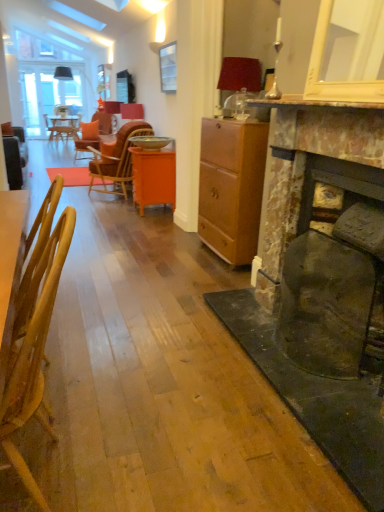
This screenshot has height=512, width=384. What do you see at coordinates (112, 113) in the screenshot? I see `matte orange lampshade at upper center, arranged as the second lamp when ordered from the bottom` at bounding box center [112, 113].

The width and height of the screenshot is (384, 512). What do you see at coordinates (240, 74) in the screenshot?
I see `matte red lampshade at upper right, which is counted as the first lamp, starting from the right` at bounding box center [240, 74].

Where is `matte red lampshade at upper right, the first lamp positioned from the front`? This screenshot has width=384, height=512. matte red lampshade at upper right, the first lamp positioned from the front is located at coordinates (240, 74).

In order to click on rusty stone fireplace at right in this screenshot , I will do `click(329, 280)`.

Identify the location of matte orange lampshade at upper center, the second lamp from the right. (112, 113).

From the picture: Between clear glass picture frame at upper center and metallic gold bowl at center, which one has more height?

clear glass picture frame at upper center is taller.

Is clear glass picture frame at upper center far away from metallic gold bowl at center?

No, clear glass picture frame at upper center is in close proximity to metallic gold bowl at center.

I want to click on round table behind the clear glass picture frame at upper center, so click(150, 142).

Is matte orange lampshade at upper center, which ranks as the 1th lamp in left-to-right order, closer to the viewer compared to clear glass picture frame at upper center?

That is False.

From a real-world perspective, does matte orange lampshade at upper center, which ranks as the second lamp in front-to-back order, stand above clear glass picture frame at upper center?

Actually, matte orange lampshade at upper center, which ranks as the second lamp in front-to-back order, is physically below clear glass picture frame at upper center in the real world.

From the image's perspective, is matte orange lampshade at upper center, which ranks as the 1th lamp in left-to-right order, located above clear glass picture frame at upper center?

Indeed, from the image's perspective, matte orange lampshade at upper center, which ranks as the 1th lamp in left-to-right order, is shown above clear glass picture frame at upper center.

Between matte orange lampshade at upper center, arranged as the second lamp when ordered from the bottom, and clear glass picture frame at upper center, which one has smaller width?

With smaller width is clear glass picture frame at upper center.

Is the surface of orange glossy cabinet at center in direct contact with matte orange lampshade at upper center, which ranks as the 1th lamp in left-to-right order?

orange glossy cabinet at center is not next to matte orange lampshade at upper center, which ranks as the 1th lamp in left-to-right order, and they're not touching.

Is orange glossy cabinet at center further to the viewer compared to matte orange lampshade at upper center, which ranks as the 1th lamp in back-to-front order?

No, the depth of orange glossy cabinet at center is less than that of matte orange lampshade at upper center, which ranks as the 1th lamp in back-to-front order.

From a real-world perspective, which object rests below the other?

From a 3D spatial view, orange glossy cabinet at center is below.

Considering the positions of objects orange glossy cabinet at center and matte orange lampshade at upper center, which is the first lamp from top to bottom, in the image provided, who is more to the left, orange glossy cabinet at center or matte orange lampshade at upper center, which is the first lamp from top to bottom,?

Positioned to the left is matte orange lampshade at upper center, which is the first lamp from top to bottom.

You are a GUI agent. You are given a task and a screenshot of the screen. Output one action in this format:
    pyautogui.click(x=<x>, y=<y>)
    Task: Click on the picture frame behind the wooden chair at left, which is the first chair in bottom-to-top order
    
    Given the screenshot: What is the action you would take?
    pyautogui.click(x=168, y=68)

Is wooden chair at left, the second chair from the top, in front of or behind clear glass picture frame at upper center in the image?

Visually, wooden chair at left, the second chair from the top, is located in front of clear glass picture frame at upper center.

Considering the sizes of wooden chair at left, the second chair from the top, and clear glass picture frame at upper center in the image, is wooden chair at left, the second chair from the top, bigger or smaller than clear glass picture frame at upper center?

Clearly, wooden chair at left, the second chair from the top, is larger in size than clear glass picture frame at upper center.

How far apart are wooden chair at left, which is the first chair in bottom-to-top order, and matte brown cabinet at center?

They are 6.51 feet apart.

Is wooden chair at left, which is the first chair in bottom-to-top order, taller than matte brown cabinet at center?

In fact, wooden chair at left, which is the first chair in bottom-to-top order, may be shorter than matte brown cabinet at center.

In the scene shown: Can you tell me how much wooden chair at left, which is the first chair in bottom-to-top order, and matte brown cabinet at center differ in facing direction?

The angular difference between wooden chair at left, which is the first chair in bottom-to-top order, and matte brown cabinet at center is 2.21 degrees.

Looking at this image, is wooden chair at left, which appears as the second chair when viewed from the back, at the left side of matte brown cabinet at center?

Yes.

Is point (212, 193) positioned in front of point (255, 81)?

No.

Is matte brown cabinet at center completely or partially outside of matte red lampshade at upper right, which is counted as the first lamp, starting from the right?

Absolutely, matte brown cabinet at center is external to matte red lampshade at upper right, which is counted as the first lamp, starting from the right.

From a real-world perspective, is matte brown cabinet at center positioned over matte red lampshade at upper right, the first lamp positioned from the front, based on gravity?

Incorrect, from a real-world perspective, matte brown cabinet at center is lower than matte red lampshade at upper right, the first lamp positioned from the front.

Is matte red lampshade at upper right, marked as the second lamp in a back-to-front arrangement, aimed at wooden chair at left, which appears as the second chair when viewed from the back?

No, matte red lampshade at upper right, marked as the second lamp in a back-to-front arrangement, is not oriented towards wooden chair at left, which appears as the second chair when viewed from the back.

Who is more distant, matte red lampshade at upper right, the 1th lamp when ordered from bottom to top, or wooden chair at left, which is the first chair in bottom-to-top order?

matte red lampshade at upper right, the 1th lamp when ordered from bottom to top, is further away from the camera.

From the image's perspective, is matte red lampshade at upper right, the first lamp positioned from the front, located beneath wooden chair at left, which appears as the second chair when viewed from the back?

No, from the image's perspective, matte red lampshade at upper right, the first lamp positioned from the front, is not beneath wooden chair at left, which appears as the second chair when viewed from the back.

In the image, is matte red lampshade at upper right, the first lamp positioned from the front, on the left side or the right side of wooden chair at left, which appears as the second chair when viewed from the back?

From the image, it's evident that matte red lampshade at upper right, the first lamp positioned from the front, is to the right of wooden chair at left, which appears as the second chair when viewed from the back.

This screenshot has width=384, height=512. What are the coordinates of `round table on the left of the clear glass picture frame at upper center` in the screenshot? It's located at (150, 142).

Find the location of a particular element. This screenshot has width=384, height=512. picture frame that is in front of the matte orange lampshade at upper center, the second lamp from the right is located at coordinates (168, 68).

From the image, which object appears to be nearer to wooden chair at left, the first chair when ordered from front to back, orange wood chair at center, marked as the first chair in a top-to-bottom arrangement, or matte red lampshade at upper right, the first lamp positioned from the front?

matte red lampshade at upper right, the first lamp positioned from the front, is positioned closer to the anchor wooden chair at left, the first chair when ordered from front to back.

Considering their positions, is matte orange lampshade at upper center, which ranks as the 1th lamp in back-to-front order, positioned closer to matte red lampshade at upper right, which is counted as the first lamp, starting from the right, than orange glossy cabinet at center?

Among the two, orange glossy cabinet at center is located nearer to matte red lampshade at upper right, which is counted as the first lamp, starting from the right.

Which object lies further to the anchor point orange wood chair at center, the 2th chair viewed from the front, metallic gold bowl at center or matte red lampshade at upper right, which ranks as the 2th lamp in top-to-bottom order?

matte red lampshade at upper right, which ranks as the 2th lamp in top-to-bottom order, is positioned further to the anchor orange wood chair at center, the 2th chair viewed from the front.

Which object lies further to the anchor point matte brown cabinet at center, wooden chair at left, the first chair when ordered from front to back, or clear glass picture frame at upper center?

clear glass picture frame at upper center is further to matte brown cabinet at center.

From the image, which object appears to be nearer to orange glossy cabinet at center, clear glass picture frame at upper center or metallic gold bowl at center?

Among the two, metallic gold bowl at center is located nearer to orange glossy cabinet at center.

Which object lies further to the anchor point clear glass picture frame at upper center, matte orange lampshade at upper center, arranged as the second lamp when ordered from the bottom, or wooden chair at left, which appears as the second chair when viewed from the back?

Among the two, wooden chair at left, which appears as the second chair when viewed from the back, is located further to clear glass picture frame at upper center.

When comparing their distances from matte red lampshade at upper right, which is counted as the first lamp, starting from the right, does rusty stone fireplace at right or clear glass picture frame at upper center seem further?

→ clear glass picture frame at upper center lies further to matte red lampshade at upper right, which is counted as the first lamp, starting from the right, than the other object.

Looking at the image, which one is located closer to wooden chair at left, the first chair when ordered from front to back, rusty stone fireplace at right or matte orange lampshade at upper center, which ranks as the second lamp in front-to-back order?

rusty stone fireplace at right.

Image resolution: width=384 pixels, height=512 pixels. I want to click on picture frame between wooden chair at left, the second chair from the top, and orange glossy cabinet at center, along the z-axis, so click(168, 68).

I want to click on chair between matte brown cabinet at center and matte orange lampshade at upper center, which ranks as the second lamp in front-to-back order, in the front-back direction, so click(117, 158).

What are the coordinates of `lamp located between wooden chair at left, which appears as the second chair when viewed from the back, and clear glass picture frame at upper center in the depth direction` in the screenshot? It's located at (240, 74).

Identify the location of fireplace located between wooden chair at left, the first chair when ordered from front to back, and matte red lampshade at upper right, the first lamp positioned from the front, in the depth direction. (329, 280).